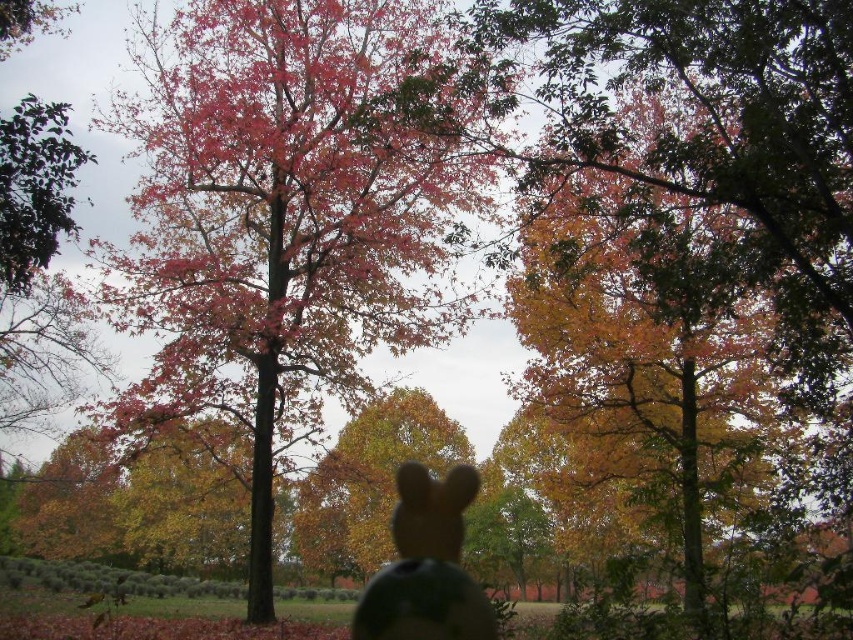
Question: Which point appears closest to the camera in this image?

Choices:
 (A) (480, 636)
 (B) (688, 81)

Answer: (A)

Question: Among these points, which one is farthest from the camera?

Choices:
 (A) (759, 164)
 (B) (440, 541)

Answer: (B)

Question: Does yellow-green leaves at center appear over brown matte plush toy at center?

Choices:
 (A) no
 (B) yes

Answer: (B)

Question: Is yellow-green leaves at center bigger than brown matte plush toy at center?

Choices:
 (A) yes
 (B) no

Answer: (A)

Question: Is yellow-green leaves at center to the right of brown matte plush toy at center from the viewer's perspective?

Choices:
 (A) yes
 (B) no

Answer: (A)

Question: Which point appears farthest from the camera in this image?

Choices:
 (A) (457, 506)
 (B) (698, 160)

Answer: (A)